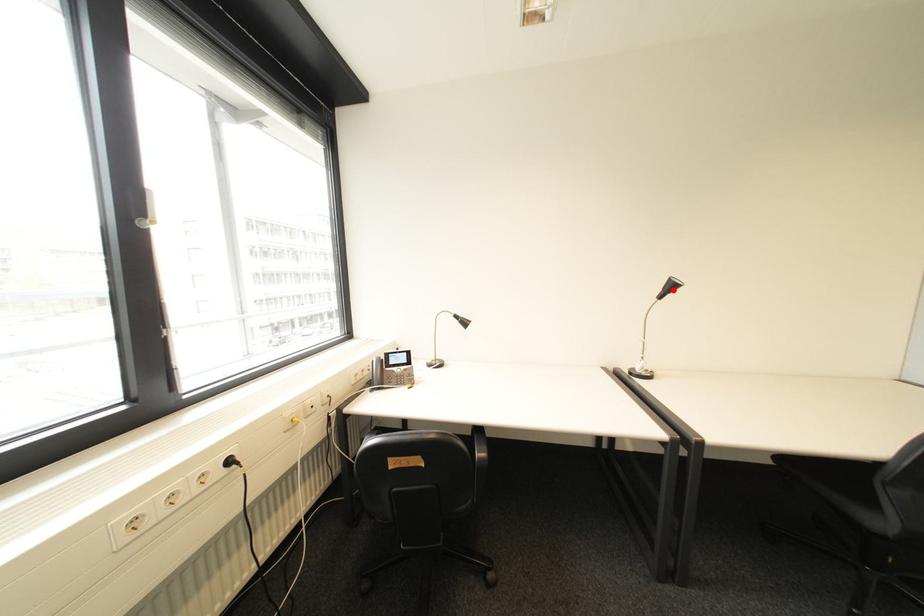
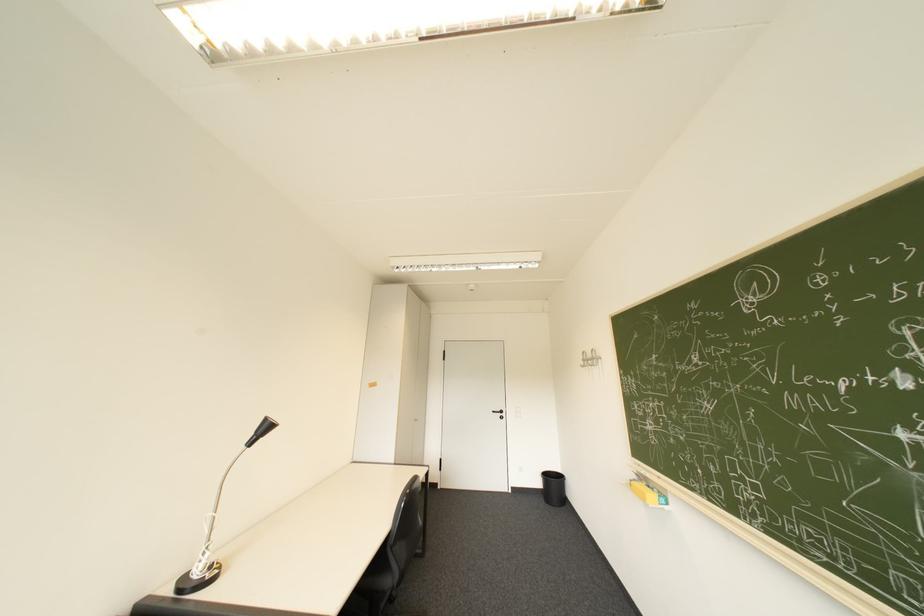
Locate, in the second image, the point that corresponds to the highlighted location in the first image.

(266, 434)